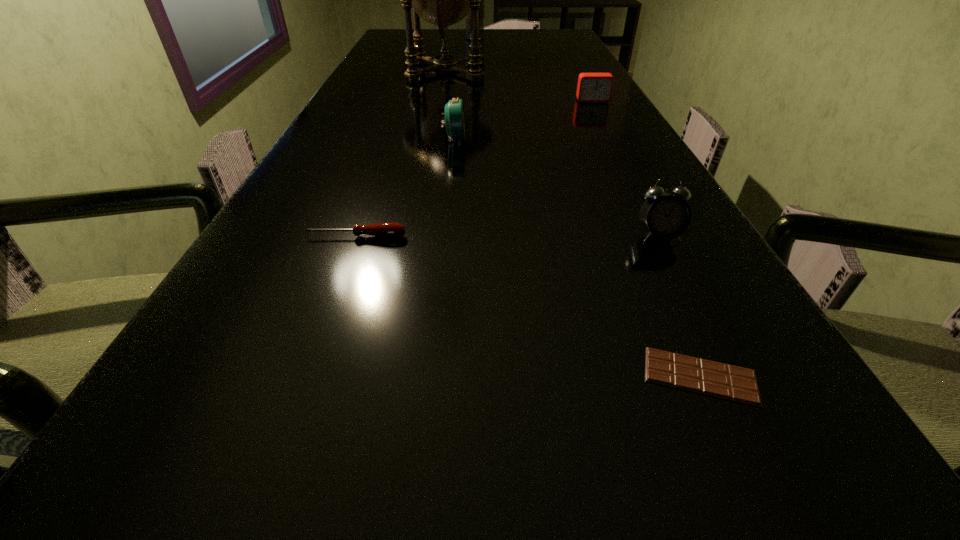
Identify the location of alarm clock that is the closest to the nearest object. (666, 216).

You are a GUI agent. You are given a task and a screenshot of the screen. Output one action in this format:
    pyautogui.click(x=<x>, y=<y>)
    Task: Click on the free space that satisfies the following two spatial constraints: 1. on the front-facing side of the leftmost alarm clock; 2. on the right side of the shortest object
    
    Given the screenshot: What is the action you would take?
    pyautogui.click(x=430, y=376)

At what (x,y) coordinates should I click in order to perform the action: click on blank area in the image that satisfies the following two spatial constraints: 1. on the back side of the shortest object; 2. on the front-facing side of the globe. Please return your answer as a coordinate pair (x, y). Looking at the image, I should click on (561, 70).

What are the coordinates of `free spot that satisfies the following two spatial constraints: 1. on the front-facing side of the nearest object; 2. on the right side of the tallest object` in the screenshot? It's located at pyautogui.click(x=387, y=376).

Locate an element on the screen. The image size is (960, 540). vacant space that satisfies the following two spatial constraints: 1. on the back side of the nearest object; 2. on the front-facing side of the tallest object is located at coordinates (561, 70).